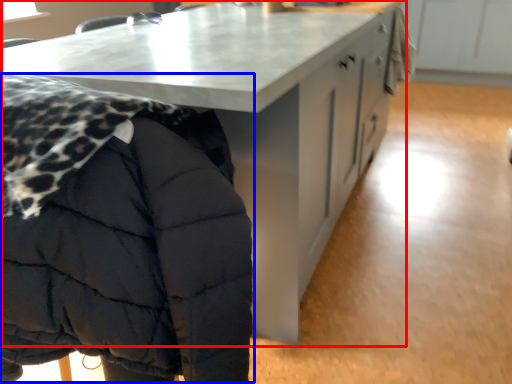
Question: Which point is closer to the camera, table (highlighted by a red box) or jacket (highlighted by a blue box)?

Choices:
 (A) table
 (B) jacket

Answer: (B)